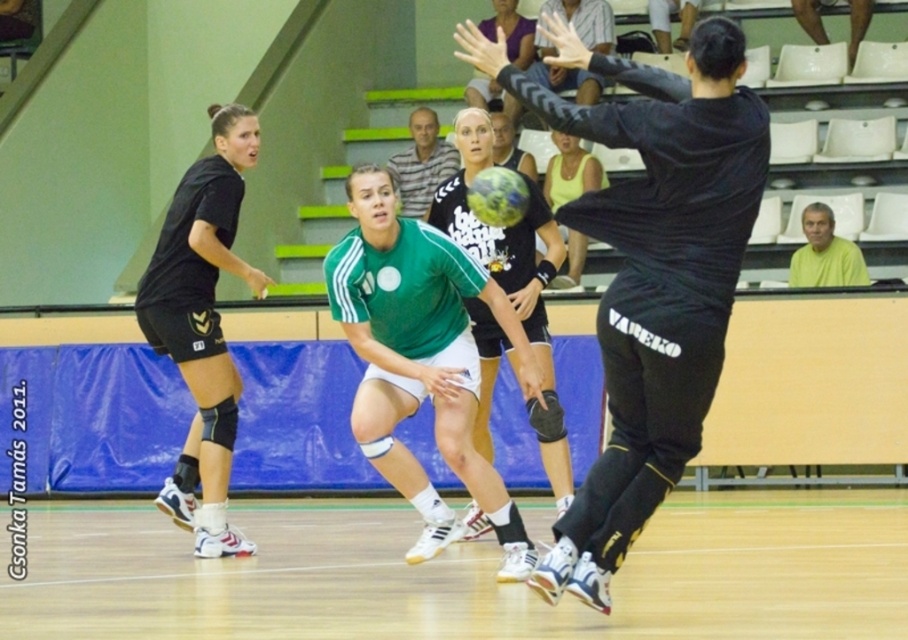
You are a handball referee observing the game. You notice two points marked on the court at coordinates point [219,380] and point [400,186]. Which point is nearer to you as you stand at the referee position?

Point [219,380] is closer to the viewer than point [400,186].

You are a referee observing the handball match. You need to determine if the black matte shorts at left is positioned above or below the yellow matte shirt at upper right. Based on the scene description, what is the spatial relationship between these two objects?

The black matte shorts at left is located below the yellow matte shirt at upper right.